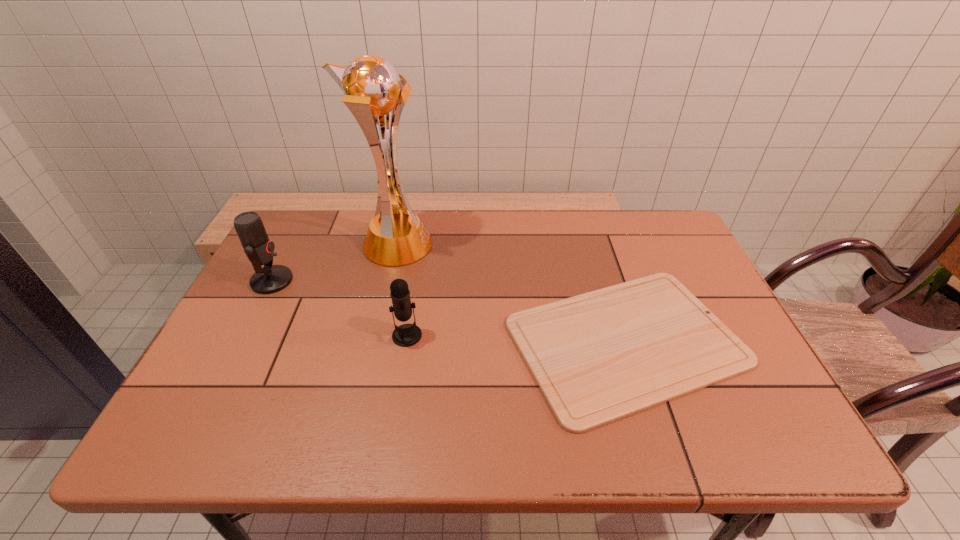
Identify the location of trophy. The image size is (960, 540). (372, 88).

The image size is (960, 540). Find the location of `the leftmost object`. the leftmost object is located at coordinates (259, 249).

Image resolution: width=960 pixels, height=540 pixels. Identify the location of the farther microphone. (259, 249).

Where is `the third tallest object`? The height and width of the screenshot is (540, 960). the third tallest object is located at coordinates (406, 335).

The height and width of the screenshot is (540, 960). What are the coordinates of `the nearer microphone` in the screenshot? It's located at (406, 335).

The height and width of the screenshot is (540, 960). Find the location of `chopping board`. chopping board is located at coordinates (597, 357).

You are a GUI agent. You are given a task and a screenshot of the screen. Output one action in this format:
    pyautogui.click(x=<x>, y=<y>)
    Task: Click on the shortest object
    The width and height of the screenshot is (960, 540).
    Given the screenshot: What is the action you would take?
    pyautogui.click(x=597, y=357)

Identify the location of free location located on the front-facing side of the tallest object. This screenshot has width=960, height=540. [475, 245].

Find the location of a particular element. vacant space located 0.300m on the side of the farther microphone with the red ring is located at coordinates (400, 281).

What are the coordinates of `vacant space located on the right of the nearer microphone` in the screenshot? It's located at (483, 336).